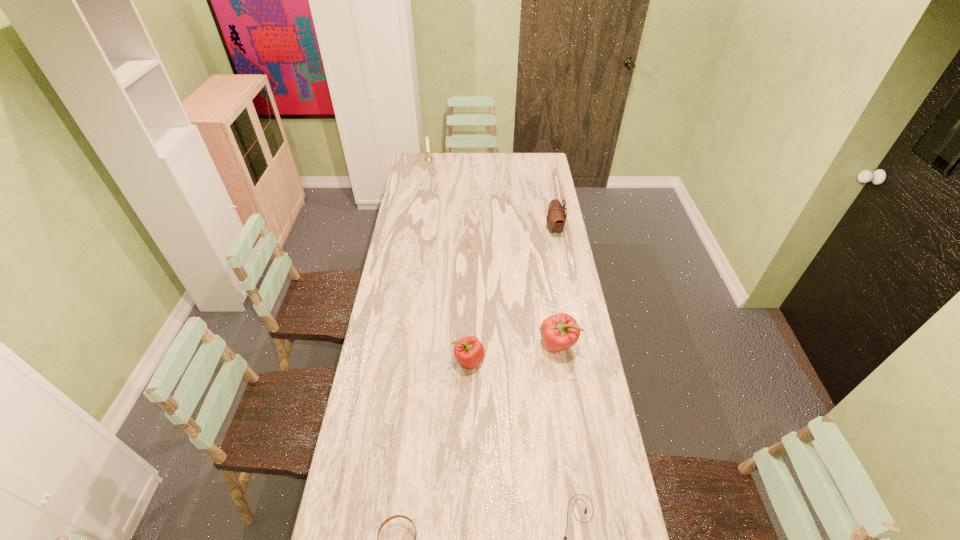
Locate an element on the screen. The width and height of the screenshot is (960, 540). free point between the farthest object and the second farthest object is located at coordinates (492, 194).

Where is `vacant area that lies between the candle holder and the right bell pepper`? The width and height of the screenshot is (960, 540). vacant area that lies between the candle holder and the right bell pepper is located at coordinates (493, 252).

At what (x,y) coordinates should I click in order to perform the action: click on free space that is in between the fourth tallest object and the right bell pepper. Please return your answer as a coordinate pair (x, y). The image size is (960, 540). Looking at the image, I should click on (514, 353).

Locate an element on the screen. This screenshot has height=540, width=960. vacant point located between the third shortest object and the taller bell pepper is located at coordinates (514, 353).

Image resolution: width=960 pixels, height=540 pixels. I want to click on free space that is in between the second farthest object and the candle holder, so click(x=492, y=194).

Where is `object identified as the closest to the goggles`? object identified as the closest to the goggles is located at coordinates (585, 512).

Identify the location of object identified as the third closest to the fourth object from right to left. (395, 516).